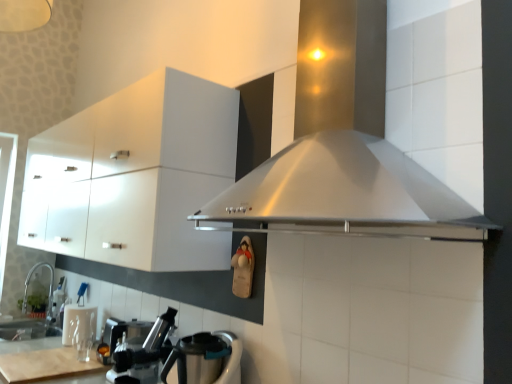
Question: Is satin nickel faucet at lower left completely or partially inside stainless steel kettle at lower left?

Choices:
 (A) no
 (B) yes

Answer: (A)

Question: Does stainless steel kettle at lower left turn towards satin nickel faucet at lower left?

Choices:
 (A) yes
 (B) no

Answer: (B)

Question: Can you confirm if stainless steel kettle at lower left is taller than satin nickel faucet at lower left?

Choices:
 (A) yes
 (B) no

Answer: (B)

Question: From the image's perspective, is stainless steel kettle at lower left beneath satin nickel faucet at lower left?

Choices:
 (A) no
 (B) yes

Answer: (A)

Question: Considering the relative sizes of stainless steel kettle at lower left and satin nickel faucet at lower left in the image provided, is stainless steel kettle at lower left wider than satin nickel faucet at lower left?

Choices:
 (A) no
 (B) yes

Answer: (B)

Question: From the image's perspective, would you say stainless steel kettle at lower left is positioned over satin nickel faucet at lower left?

Choices:
 (A) no
 (B) yes

Answer: (B)

Question: From a real-world perspective, is satin nickel faucet at lower left on top of metallic silver coffee machine at lower left?

Choices:
 (A) yes
 (B) no

Answer: (A)

Question: Could you tell me if satin nickel faucet at lower left is facing metallic silver coffee machine at lower left?

Choices:
 (A) no
 (B) yes

Answer: (B)

Question: Does satin nickel faucet at lower left have a larger size compared to metallic silver coffee machine at lower left?

Choices:
 (A) yes
 (B) no

Answer: (A)

Question: Does satin nickel faucet at lower left have a lesser height compared to metallic silver coffee machine at lower left?

Choices:
 (A) no
 (B) yes

Answer: (A)

Question: Can you confirm if satin nickel faucet at lower left is positioned to the left of metallic silver coffee machine at lower left?

Choices:
 (A) no
 (B) yes

Answer: (B)

Question: Is the position of satin nickel faucet at lower left more distant than that of metallic silver coffee machine at lower left?

Choices:
 (A) yes
 (B) no

Answer: (A)

Question: From a real-world perspective, is metallic silver coffee machine at lower left beneath stainless steel kettle at lower left?

Choices:
 (A) no
 (B) yes

Answer: (A)